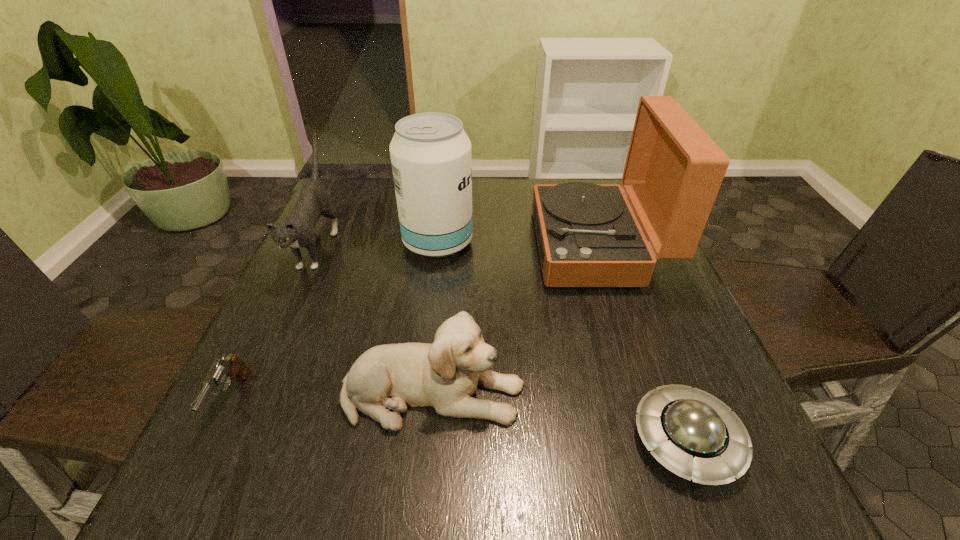
Select which object appears as the second closest to the puppy. Please provide its 2D coordinates. Your answer should be formatted as a tuple, i.e. [(x, y)], where the tuple contains the x and y coordinates of a point satisfying the conditions above.

[(229, 368)]

Select which object is the third closest to the pistol. Please provide its 2D coordinates. Your answer should be formatted as a tuple, i.e. [(x, y)], where the tuple contains the x and y coordinates of a point satisfying the conditions above.

[(431, 159)]

Locate an element on the screen. The height and width of the screenshot is (540, 960). vacant space that satisfies the following two spatial constraints: 1. on the back side of the shortest object; 2. on the front-facing side of the fourth tallest object is located at coordinates (669, 394).

At what (x,y) coordinates should I click in order to perform the action: click on vacant area in the image that satisfies the following two spatial constraints: 1. on the face of the phonograph record; 2. on the right side of the saucer. Please return your answer as a coordinate pair (x, y). The image size is (960, 540). Looking at the image, I should click on (661, 440).

The height and width of the screenshot is (540, 960). Find the location of `vacant point that satisfies the following two spatial constraints: 1. on the front side of the shortest object; 2. on the right side of the alcohol`. vacant point that satisfies the following two spatial constraints: 1. on the front side of the shortest object; 2. on the right side of the alcohol is located at coordinates (414, 440).

The width and height of the screenshot is (960, 540). Find the location of `vacant area that satisfies the following two spatial constraints: 1. on the face of the phonograph record; 2. at the barrel of the pistol`. vacant area that satisfies the following two spatial constraints: 1. on the face of the phonograph record; 2. at the barrel of the pistol is located at coordinates (648, 401).

This screenshot has width=960, height=540. Find the location of `free space that satisfies the following two spatial constraints: 1. on the face of the phonograph record; 2. on the left side of the shortest object`. free space that satisfies the following two spatial constraints: 1. on the face of the phonograph record; 2. on the left side of the shortest object is located at coordinates (661, 440).

The height and width of the screenshot is (540, 960). I want to click on vacant position in the image that satisfies the following two spatial constraints: 1. on the back side of the shortest object; 2. on the face of the phonograph record, so click(x=613, y=246).